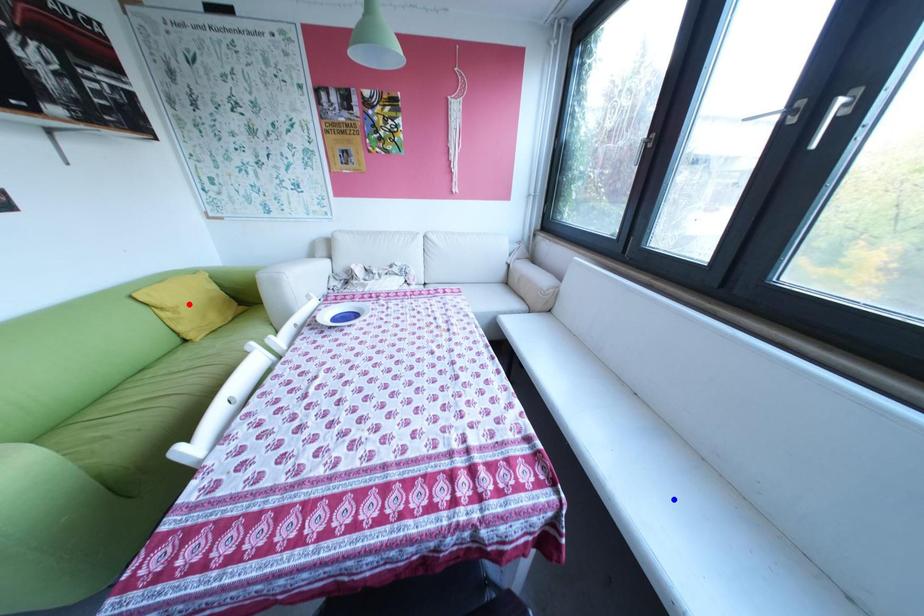
Question: In the image, two points are highlighted. Which point is nearer to the camera? Reply with the corresponding letter.

Choices:
 (A) blue point
 (B) red point

Answer: (A)